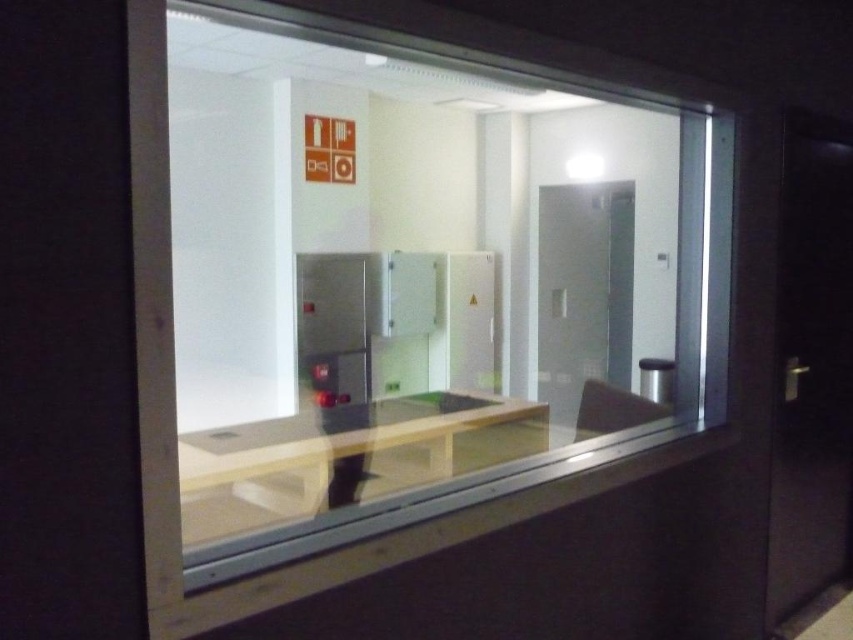
You are a delivery robot with a package that is 1.5 meters long. You need to deliver it through the transparent glass window at center. Can you fit the package through the window?

The transparent glass window at center and camera are 3.89 meters apart from each other, so the distance between the transparent glass window at center and the camera is sufficient to fit the 1.5 meters long package. However, the question is about fitting through the window, not the distance to the camera. The provided information does not specify the dimensions of the window itself, so it is impossible to determine if the package can fit through the window based on the given data.

You are an inspector checking the safety of the transparent glass window at center and the transparent glass elevator at center. Which one has a larger surface area for visibility?

The transparent glass window at center has a larger surface area for visibility than the transparent glass elevator at center, as it is described to be larger in size.

You are a maintenance worker needing to access the transparent glass elevator at center for repairs. However, there is a transparent glass window at center blocking your path. Can you reach the elevator without going around the window?

Result: The transparent glass window at center is positioned over the transparent glass elevator at center, so you can reach the elevator by moving under the window.